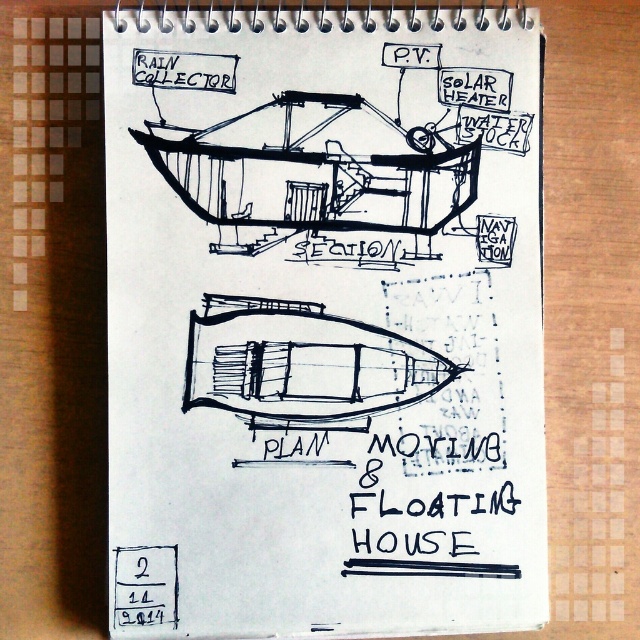
Is point (246, 212) positioned after point (387, 502)?

Yes, point (246, 212) is behind point (387, 502).

Is point (250, 156) positioned in front of point (496, 516)?

No, (250, 156) is behind (496, 516).

Is point (291, 92) farther from viewer compared to point (484, 513)?

Yes, it is.

Where is `black line drawing boat at center`? This screenshot has width=640, height=640. black line drawing boat at center is located at coordinates (314, 179).

Is black ink drawing at center above black line drawing boat at center?

No.

Between black ink drawing at center and black line drawing boat at center, which one appears on the right side from the viewer's perspective?

Positioned to the right is black ink drawing at center.

Is point (264, 440) farther from camera compared to point (248, 228)?

No.

You are a GUI agent. You are given a task and a screenshot of the screen. Output one action in this format:
    pyautogui.click(x=<x>, y=<y>)
    Task: Click on the black ink drawing at center
    The width and height of the screenshot is (640, 640).
    Given the screenshot: What is the action you would take?
    click(x=323, y=324)

Which of these two, black ink drawing at center or black ink text at lower center, stands shorter?

black ink text at lower center

Is black ink drawing at center below black ink text at lower center?

No.

This screenshot has width=640, height=640. Describe the element at coordinates (323, 324) in the screenshot. I see `black ink drawing at center` at that location.

Identify the location of black ink drawing at center. This screenshot has height=640, width=640. (323, 324).